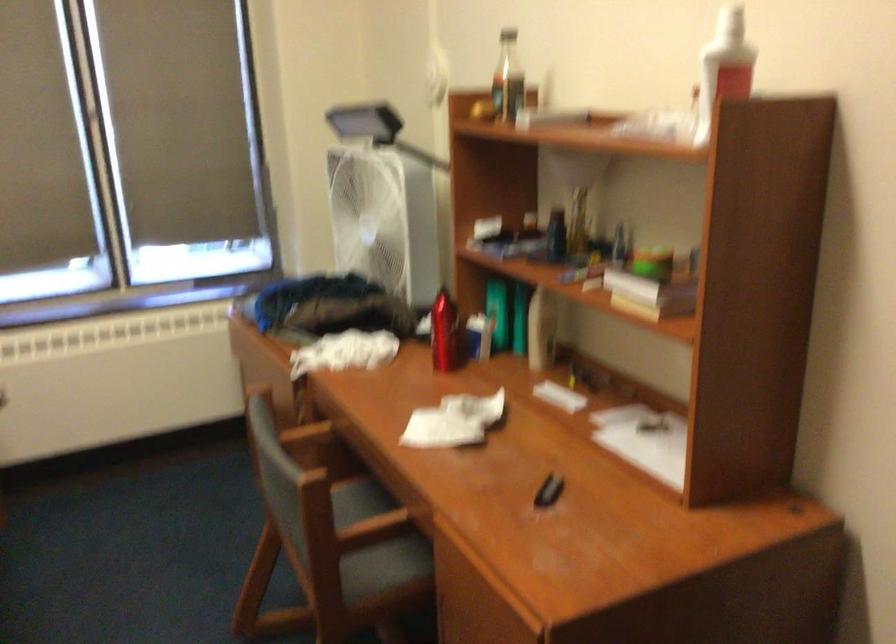
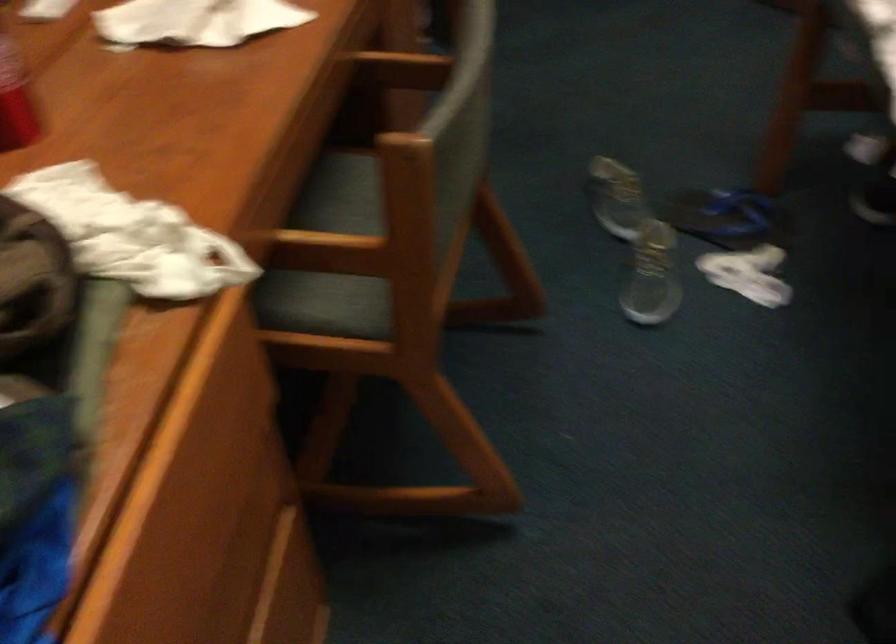
The point at (374, 536) is marked in the first image. Where is the corresponding point in the second image?

(401, 69)